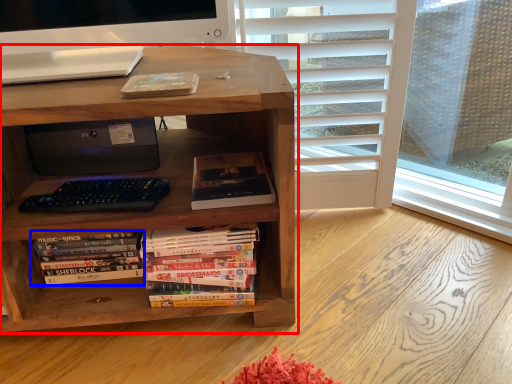
Question: Which object appears closest to the camera in this image, bookcase (highlighted by a red box) or book (highlighted by a blue box)?

Choices:
 (A) bookcase
 (B) book

Answer: (A)